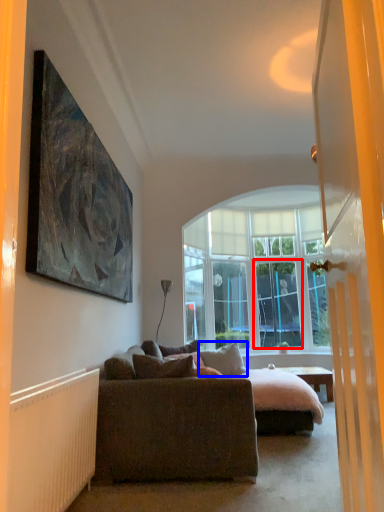
Question: Which of the following is the closest to the observer, screen door (highlighted by a red box) or pillow (highlighted by a blue box)?

Choices:
 (A) screen door
 (B) pillow

Answer: (B)